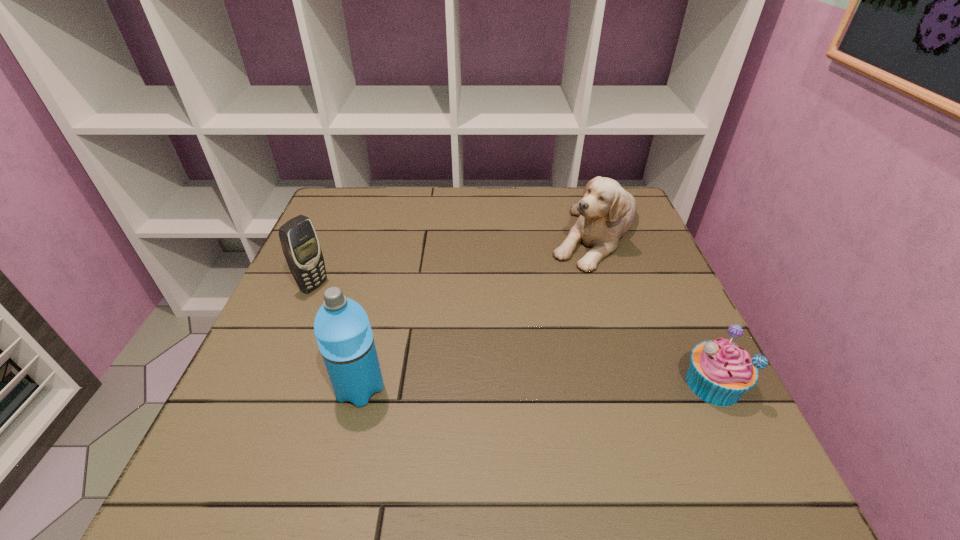
Where is `vacant space on the desktop that is between the second object from left to right and the muffin and is positioned on the front-facing side of the puppy`? vacant space on the desktop that is between the second object from left to right and the muffin and is positioned on the front-facing side of the puppy is located at coordinates (524, 386).

Locate an element on the screen. vacant spot on the desktop that is between the tallest object and the muffin and is positioned on the front face of the leftmost object is located at coordinates (521, 386).